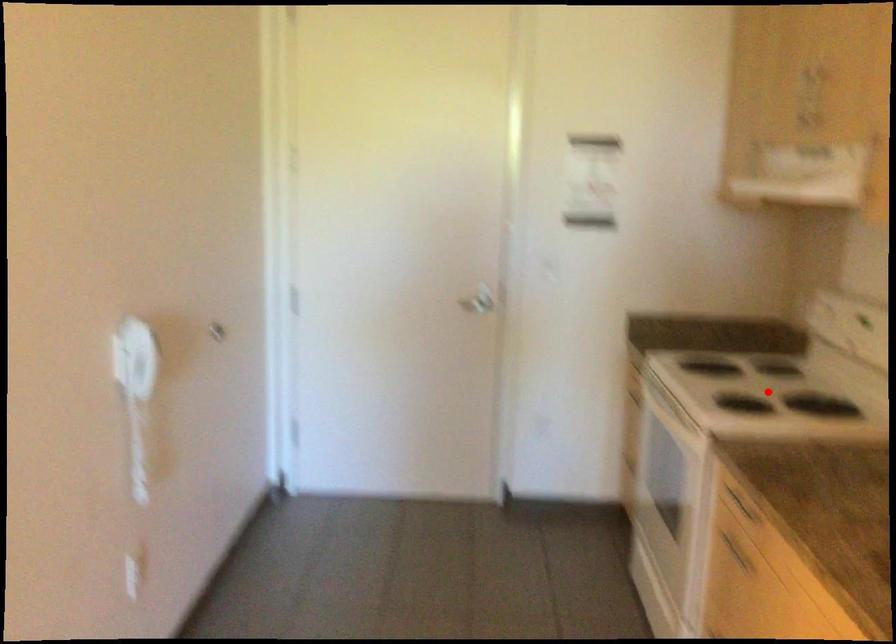
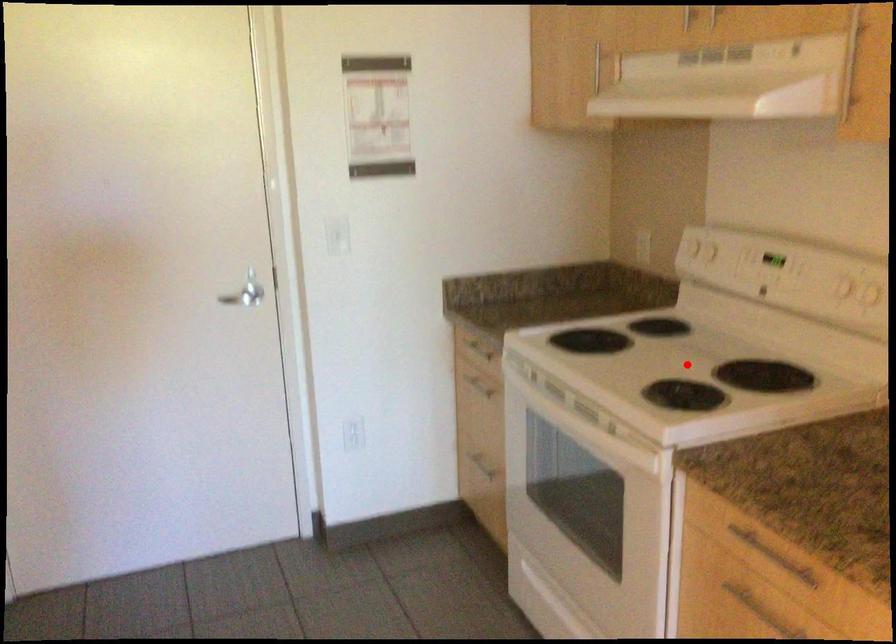
I am providing you with two images of the same scene from different viewpoints. A red point is marked on the first image and another point is marked on the second image. Is the red point in image1 aligned with the point shown in image2?

Yes